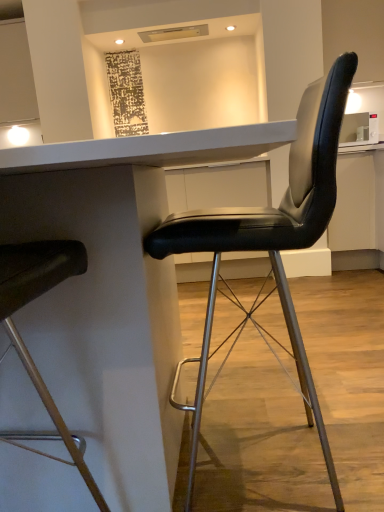
Question: From a real-world perspective, is white glossy table at center under black leather chair at right, acting as the 2th chair starting from the left?

Choices:
 (A) no
 (B) yes

Answer: (B)

Question: Is white glossy table at center outside black leather chair at right, acting as the 2th chair starting from the left?

Choices:
 (A) no
 (B) yes

Answer: (B)

Question: Is there a large distance between white glossy table at center and black leather chair at right, the first chair in the right-to-left sequence?

Choices:
 (A) no
 (B) yes

Answer: (A)

Question: From the image's perspective, is white glossy table at center located above black leather chair at right, acting as the 2th chair starting from the left?

Choices:
 (A) no
 (B) yes

Answer: (A)

Question: Can you confirm if white glossy table at center is thinner than black leather chair at right, acting as the 2th chair starting from the left?

Choices:
 (A) no
 (B) yes

Answer: (A)

Question: Considering the relative sizes of white glossy table at center and black leather chair at right, acting as the 2th chair starting from the left, in the image provided, is white glossy table at center bigger than black leather chair at right, acting as the 2th chair starting from the left,?

Choices:
 (A) no
 (B) yes

Answer: (B)

Question: Is white glossy table at center positioned beyond the bounds of matte black chair at left, which appears as the 2th chair when viewed from the right?

Choices:
 (A) yes
 (B) no

Answer: (A)

Question: Considering the relative sizes of white glossy table at center and matte black chair at left, which appears as the 2th chair when viewed from the right, in the image provided, is white glossy table at center taller than matte black chair at left, which appears as the 2th chair when viewed from the right,?

Choices:
 (A) yes
 (B) no

Answer: (B)

Question: From a real-world perspective, is white glossy table at center over matte black chair at left, which appears as the 2th chair when viewed from the right?

Choices:
 (A) yes
 (B) no

Answer: (B)

Question: Is white glossy table at center bigger than matte black chair at left, which appears as the 2th chair when viewed from the right?

Choices:
 (A) yes
 (B) no

Answer: (A)

Question: Is white glossy table at center to the left of matte black chair at left, which appears as the 2th chair when viewed from the right, from the viewer's perspective?

Choices:
 (A) no
 (B) yes

Answer: (A)

Question: Is white glossy table at center in contact with matte black chair at left, which appears as the 2th chair when viewed from the right?

Choices:
 (A) no
 (B) yes

Answer: (A)

Question: Considering the relative positions of black leather chair at right, acting as the 2th chair starting from the left, and white glossy table at center in the image provided, is black leather chair at right, acting as the 2th chair starting from the left, to the left of white glossy table at center from the viewer's perspective?

Choices:
 (A) no
 (B) yes

Answer: (A)